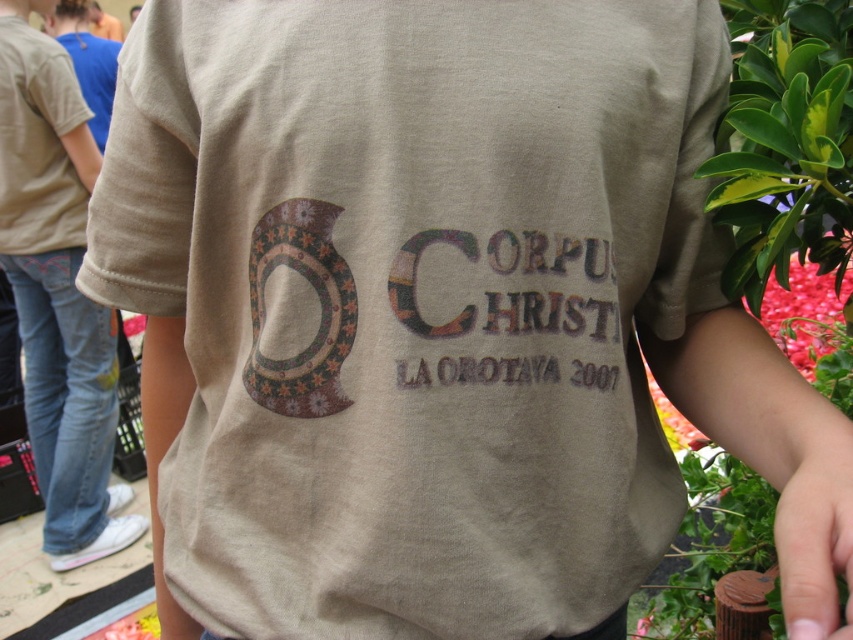
You are a fashion designer analyzing a shirt design. You notice a point at coordinates point (x=57, y=292). Based on the scene description, what object does this coordinate correspond to?

The point (x=57, y=292) corresponds to the light brown cotton shirt at center.

You are a fashion designer examining a shirt. You notice the light brown cotton shirt at center and the distressed brown text at center. Which of these two elements is positioned higher on the shirt?

The light brown cotton shirt at center is taller than the distressed brown text at center, so the shirt element is positioned higher.